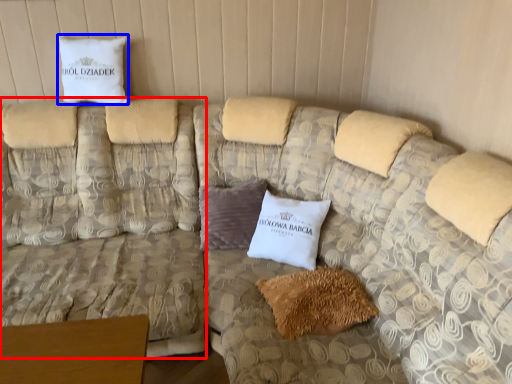
Question: Which of the following is the closest to the observer, couch (highlighted by a red box) or pillow (highlighted by a blue box)?

Choices:
 (A) couch
 (B) pillow

Answer: (A)